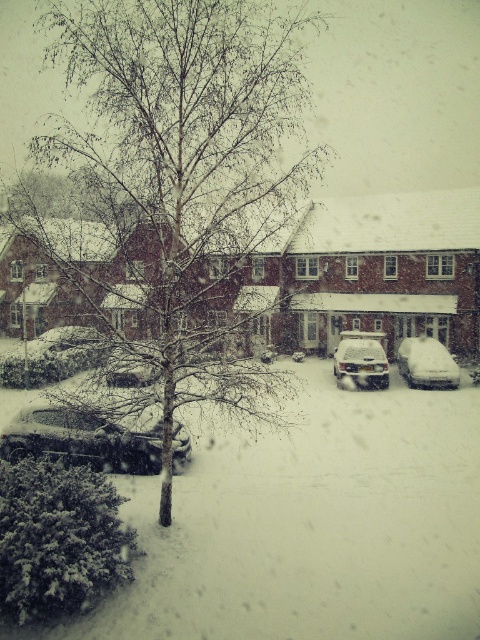
Is white fluffy snow at center smaller than snow-covered car at center?

Incorrect, white fluffy snow at center is not smaller in size than snow-covered car at center.

Can you confirm if white fluffy snow at center is shorter than snow-covered car at center?

Yes, white fluffy snow at center is shorter than snow-covered car at center.

Measure the distance between white fluffy snow at center and camera.

They are 7.70 meters apart.

Find the location of a particular element. The height and width of the screenshot is (640, 480). white fluffy snow at center is located at coordinates (312, 525).

Does bare branches at center have a lesser height compared to shiny silver car at lower left?

Incorrect, bare branches at center's height does not fall short of shiny silver car at lower left's.

Can you confirm if bare branches at center is positioned above shiny silver car at lower left?

Yes, bare branches at center is above shiny silver car at lower left.

Is point (126, 92) farther from viewer compared to point (15, 449)?

That is False.

You are a GUI agent. You are given a task and a screenshot of the screen. Output one action in this format:
    pyautogui.click(x=<x>, y=<y>)
    Task: Click on the bare branches at center
    The width and height of the screenshot is (480, 640).
    Given the screenshot: What is the action you would take?
    pyautogui.click(x=184, y=154)

Between shiny silver car at lower left and sleek silver sedan at center, which one is positioned lower?

shiny silver car at lower left

Can you confirm if shiny silver car at lower left is positioned below sleek silver sedan at center?

Indeed, shiny silver car at lower left is positioned under sleek silver sedan at center.

Where is `shiny silver car at lower left`? shiny silver car at lower left is located at coordinates (84, 440).